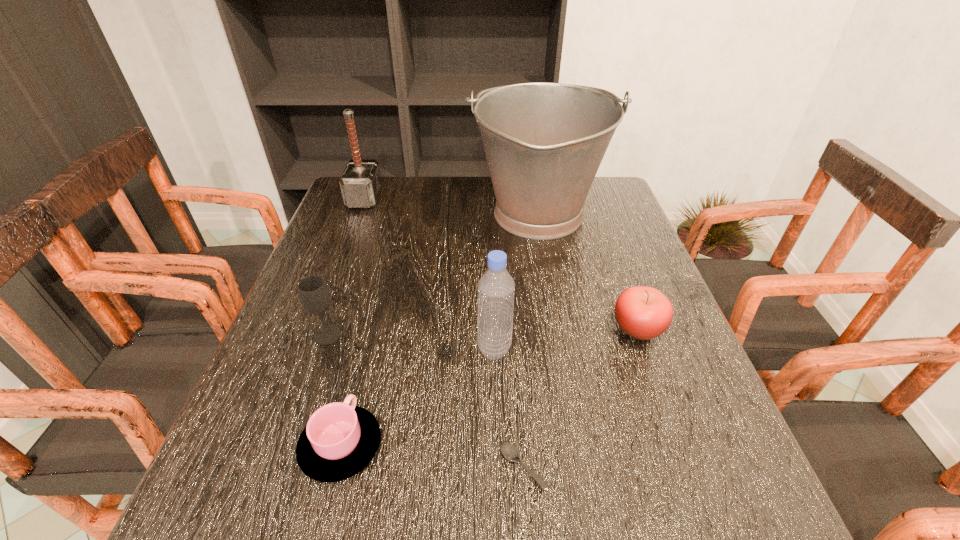
This screenshot has width=960, height=540. Identify the location of unoccupied position between the cup and the hammer. (353, 322).

Identify the location of unoccupied position between the second shortest object and the bottle. (418, 397).

You are a GUI agent. You are given a task and a screenshot of the screen. Output one action in this format:
    pyautogui.click(x=<x>, y=<y>)
    Task: Click on the vacant area that lies between the hammer and the fourth shortest object
    
    Given the screenshot: What is the action you would take?
    pyautogui.click(x=347, y=267)

Where is `blank region between the soupspoon and the hammer`? The height and width of the screenshot is (540, 960). blank region between the soupspoon and the hammer is located at coordinates (444, 333).

The width and height of the screenshot is (960, 540). In order to click on object that stands as the fourth closest to the fourth shortest object in this screenshot , I will do `click(510, 451)`.

I want to click on object that can be found as the second closest to the tallest object, so click(x=496, y=288).

Where is `vacant point that satisfies the following two spatial constraints: 1. on the side with the handle of the second shortest object; 2. on the left side of the fifth tallest object`? This screenshot has height=540, width=960. vacant point that satisfies the following two spatial constraints: 1. on the side with the handle of the second shortest object; 2. on the left side of the fifth tallest object is located at coordinates (371, 328).